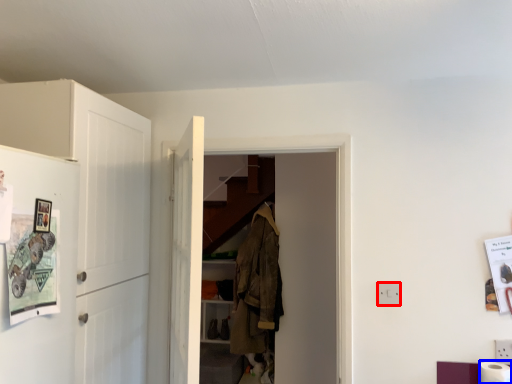
Question: Which object appears farthest to the camera in this image, electric outlet (highlighted by a red box) or toilet paper (highlighted by a blue box)?

Choices:
 (A) electric outlet
 (B) toilet paper

Answer: (A)